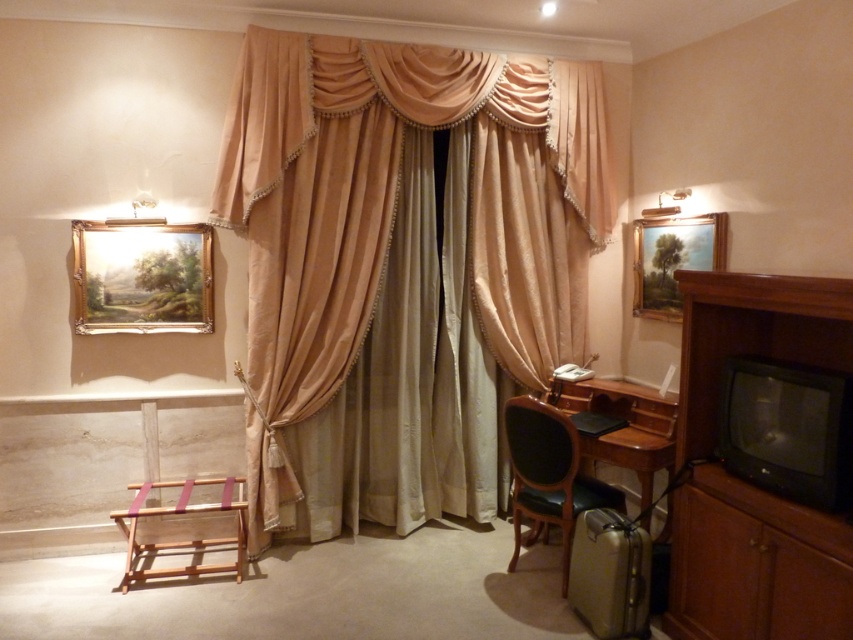
You are moving a small potted plant that is 0.5 meters wide. You want to place it on either the brown wood dresser at right or the dark green leather chair at lower right. Which surface can accommodate the plant without it falling off?

The brown wood dresser at right has a larger size compared to the dark green leather chair at lower right, so the potted plant can be placed on the brown wood dresser at right since it has a wider surface area to support the plant without it falling off.

You are moving a small plant that is 1.2 meters wide and need to place it between the brown wood dresser at right and the wooden stool at lower left. Can the plant fit in the space between them?

The brown wood dresser at right has a lesser width compared to wooden stool at lower left. Since the dresser is narrower than the stool, the space between them might be sufficient for the plant. However, without knowing the exact distance between the two objects, it is impossible to determine if the 1.2 meters wide plant will fit. Please check the actual space available.